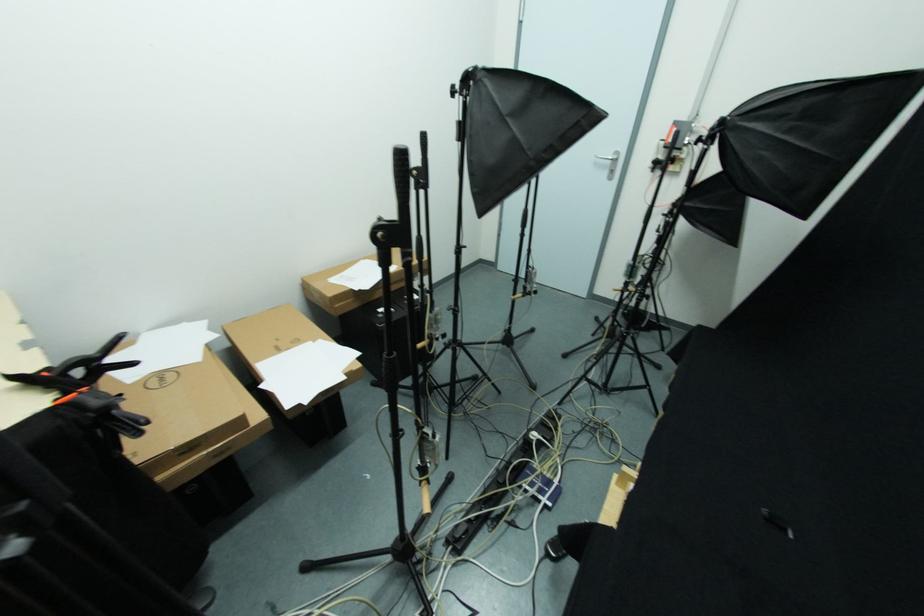
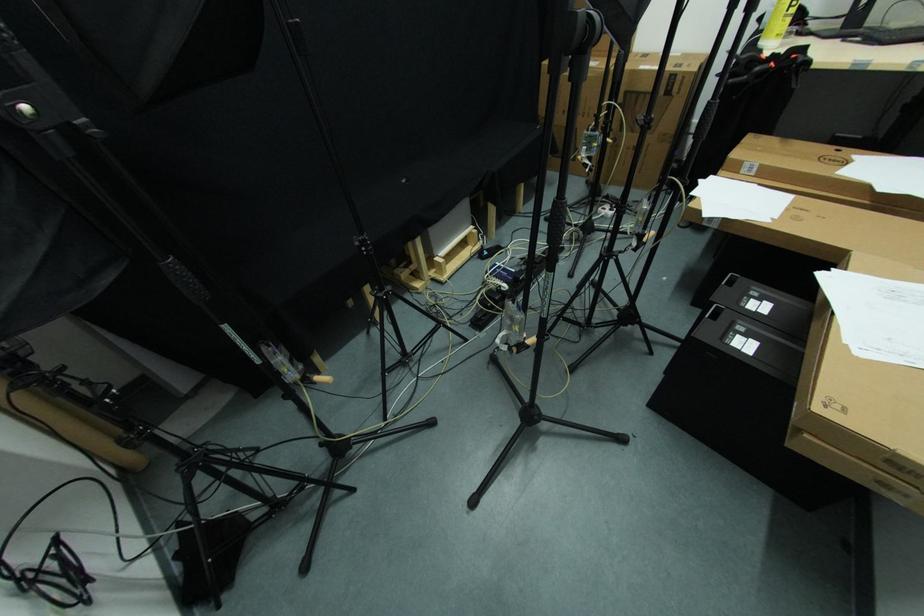
In the second image, find the point that corresponds to the point at 360,292 in the first image.

(830, 273)